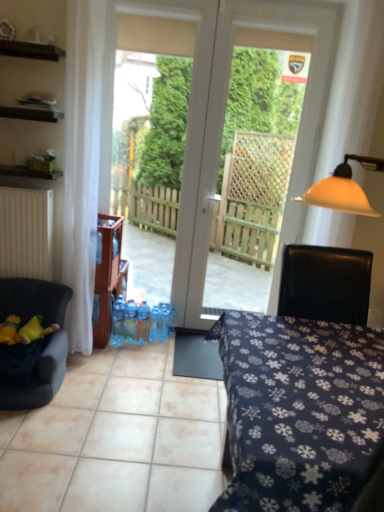
What are the coordinates of `free space on the front side of clear plastic bottles at center, the first bottle positioned from the left` in the screenshot? It's located at (117, 354).